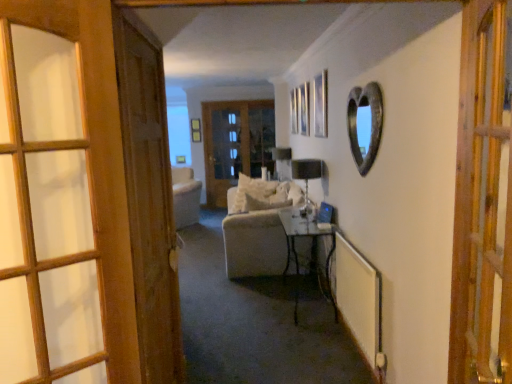
Question: Is white soft pillow at center smaller than matte wooden picture frame at upper center, the second picture frame in the right-to-left sequence?

Choices:
 (A) no
 (B) yes

Answer: (A)

Question: From a real-world perspective, is white soft pillow at center located higher than matte wooden picture frame at upper center, the second picture frame in the right-to-left sequence?

Choices:
 (A) no
 (B) yes

Answer: (A)

Question: From the image's perspective, does white soft pillow at center appear lower than matte wooden picture frame at upper center, the second picture frame when ordered from bottom to top?

Choices:
 (A) yes
 (B) no

Answer: (A)

Question: From a real-world perspective, is white soft pillow at center positioned under matte wooden picture frame at upper center, marked as the first picture frame in a left-to-right arrangement, based on gravity?

Choices:
 (A) yes
 (B) no

Answer: (A)

Question: Can you confirm if white soft pillow at center is bigger than matte wooden picture frame at upper center, the second picture frame in the right-to-left sequence?

Choices:
 (A) no
 (B) yes

Answer: (B)

Question: From the image's perspective, is matte black lampshade at center, placed as the second lamp when sorted from front to back, located above or below rustic metal heart-shaped mirror at upper right?

Choices:
 (A) above
 (B) below

Answer: (A)

Question: Relative to rustic metal heart-shaped mirror at upper right, is matte black lampshade at center, placed as the second lamp when sorted from front to back, in front or behind?

Choices:
 (A) front
 (B) behind

Answer: (B)

Question: In terms of height, does matte black lampshade at center, placed as the second lamp when sorted from front to back, look taller or shorter compared to rustic metal heart-shaped mirror at upper right?

Choices:
 (A) tall
 (B) short

Answer: (B)

Question: Do you think matte black lampshade at center, placed as the second lamp when sorted from front to back, is within rustic metal heart-shaped mirror at upper right, or outside of it?

Choices:
 (A) inside
 (B) outside

Answer: (B)

Question: Is white soft pillow at center taller or shorter than matte wooden picture frame at upper center, the second picture frame in the right-to-left sequence?

Choices:
 (A) short
 (B) tall

Answer: (B)

Question: From a real-world perspective, relative to matte wooden picture frame at upper center, the second picture frame in the right-to-left sequence, is white soft pillow at center vertically above or below?

Choices:
 (A) above
 (B) below

Answer: (B)

Question: Looking at their shapes, would you say white soft pillow at center is wider or thinner than matte wooden picture frame at upper center, marked as the first picture frame in a left-to-right arrangement?

Choices:
 (A) wide
 (B) thin

Answer: (A)

Question: Is point (241, 200) positioned closer to the camera than point (193, 132)?

Choices:
 (A) closer
 (B) farther

Answer: (A)

Question: From a real-world perspective, is rustic metal heart-shaped mirror at upper right physically located above or below wooden door at left, the second door in the front-to-back sequence?

Choices:
 (A) above
 (B) below

Answer: (A)

Question: From the image's perspective, relative to wooden door at left, placed as the third door when sorted from back to front, is rustic metal heart-shaped mirror at upper right above or below?

Choices:
 (A) below
 (B) above

Answer: (B)